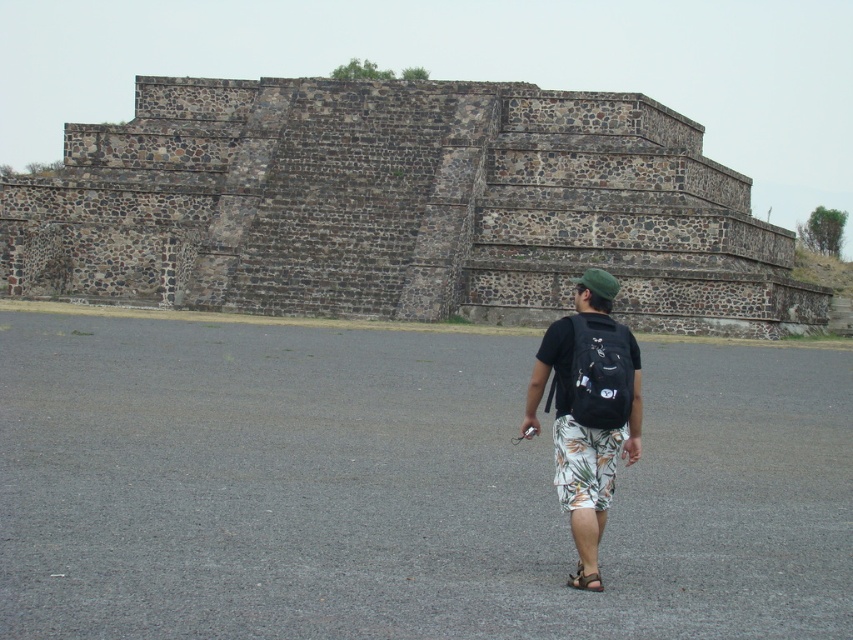
You are standing in front of the rustic stone pyramid at center and the black fabric backpack at center. Which object is positioned to the left from your perspective?

The rustic stone pyramid at center is positioned to the left of the black fabric backpack at center.

You are standing at the base of the rustic stone pyramid at center and want to place your black fabric backpack at center somewhere near you. Given that the backpack is 2 feet in width, can you safely place it without it being too close to the pyramid?

The rustic stone pyramid at center and black fabric backpack at center are 54.29 feet apart. Since the backpack is only 2 feet wide, placing it near the pyramid would leave ample space between them, so yes, you can safely place it without it being too close.